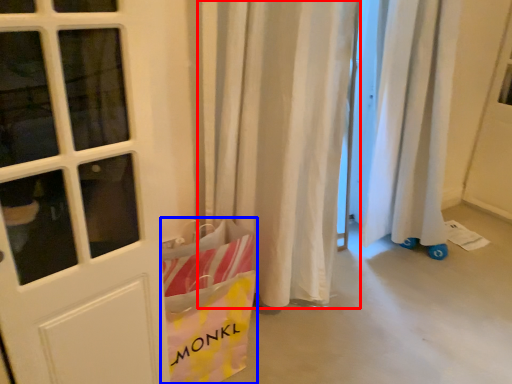
Question: Which object appears farthest to the camera in this image, curtain (highlighted by a red box) or grocery bag (highlighted by a blue box)?

Choices:
 (A) curtain
 (B) grocery bag

Answer: (B)